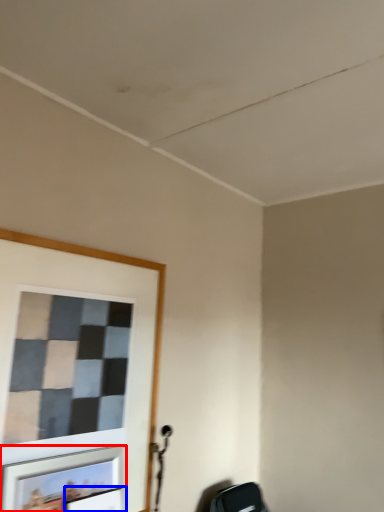
Question: Which point is further to the camera, picture frame (highlighted by a red box) or picture frame (highlighted by a blue box)?

Choices:
 (A) picture frame
 (B) picture frame

Answer: (B)